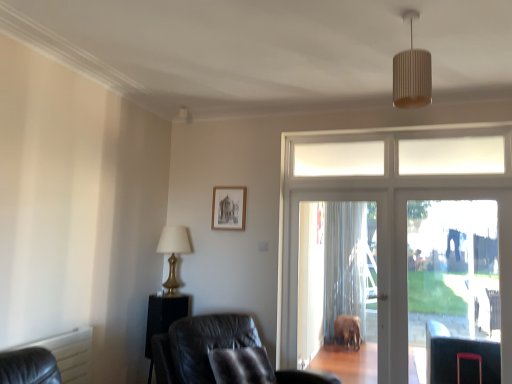
Describe the element at coordinates (229, 208) in the screenshot. I see `wooden picture frame at center` at that location.

Identify the location of transparent glass screen door at right, which is the second screen door in left-to-right order. (457, 282).

What do you see at coordinates (377, 257) in the screenshot? I see `translucent plastic screen door at center, acting as the 2th screen door starting from the right` at bounding box center [377, 257].

At what (x,y) coordinates should I click in order to perform the action: click on translucent plastic screen door at center, acting as the 2th screen door starting from the right. Please return your answer as a coordinate pair (x, y). This screenshot has height=384, width=512. Looking at the image, I should click on (377, 257).

What do you see at coordinates (163, 318) in the screenshot? The image size is (512, 384). I see `black leather side table at lower left` at bounding box center [163, 318].

The width and height of the screenshot is (512, 384). Describe the element at coordinates (199, 346) in the screenshot. I see `leather chair at lower center` at that location.

Where is `wooden picture frame at center`? wooden picture frame at center is located at coordinates (229, 208).

From a real-world perspective, is wooden picture frame at center under leather chair at lower center?

Incorrect, from a real-world perspective, wooden picture frame at center is higher than leather chair at lower center.

Does point (222, 225) come farther from viewer compared to point (180, 347)?

Yes, point (222, 225) is farther from viewer.

From the image's perspective, between wooden picture frame at center and leather chair at lower center, which one is located above?

From the image's view, wooden picture frame at center is above.

Between wooden picture frame at center and leather chair at lower center, which one has smaller size?

wooden picture frame at center.

Is transparent glass screen door at right, which is the second screen door in left-to-right order, to the left or to the right of wooden picture frame at center in the image?

Clearly, transparent glass screen door at right, which is the second screen door in left-to-right order, is on the right of wooden picture frame at center in the image.

Can wooden picture frame at center be found inside transparent glass screen door at right, which is the second screen door in left-to-right order?

No.

Does transparent glass screen door at right, the 1th screen door from the right, come behind wooden picture frame at center?

No, the depth of transparent glass screen door at right, the 1th screen door from the right, is less than that of wooden picture frame at center.

Is transparent glass screen door at right, which is the second screen door in left-to-right order, looking in the opposite direction of wooden picture frame at center?

transparent glass screen door at right, which is the second screen door in left-to-right order, does not have its back to wooden picture frame at center.

Does gold metallic table lamp at left touch transparent glass screen door at right, which is the second screen door in left-to-right order?

They are not placed beside each other.

Which of these two, gold metallic table lamp at left or transparent glass screen door at right, which is the second screen door in left-to-right order, is thinner?

transparent glass screen door at right, which is the second screen door in left-to-right order.

Can you tell me how much gold metallic table lamp at left and transparent glass screen door at right, which is the second screen door in left-to-right order, differ in facing direction?

2.77 degrees separate the facing orientations of gold metallic table lamp at left and transparent glass screen door at right, which is the second screen door in left-to-right order.

From the image's perspective, is gold metallic table lamp at left located above transparent glass screen door at right, which is the second screen door in left-to-right order?

Indeed, from the image's perspective, gold metallic table lamp at left is shown above transparent glass screen door at right, which is the second screen door in left-to-right order.

Is point (162, 338) closer or farther from the camera than point (178, 233)?

Clearly, point (162, 338) is closer to the camera than point (178, 233).

Is leather chair at lower center far away from gold metallic table lamp at left?

No, there isn't a large distance between leather chair at lower center and gold metallic table lamp at left.

Is leather chair at lower center facing towards gold metallic table lamp at left?

No, leather chair at lower center does not turn towards gold metallic table lamp at left.

Based on their positions, is leather chair at lower center located to the left or right of translucent plastic screen door at center, acting as the 2th screen door starting from the right?

leather chair at lower center is to the left of translucent plastic screen door at center, acting as the 2th screen door starting from the right.

Between point (158, 346) and point (387, 382), which one is positioned in front?

The point (158, 346) is closer to the camera.

Can we say leather chair at lower center lies outside translucent plastic screen door at center, acting as the 2th screen door starting from the right?

Absolutely, leather chair at lower center is external to translucent plastic screen door at center, acting as the 2th screen door starting from the right.

Is the depth of wooden picture frame at center greater than that of black leather side table at lower left?

That is True.

Which is nearer, [218,203] or [190,305]?

Clearly, point [218,203] is more distant from the camera than point [190,305].

Which is more to the left, wooden picture frame at center or black leather side table at lower left?

From the viewer's perspective, black leather side table at lower left appears more on the left side.

Considering the sizes of wooden picture frame at center and black leather side table at lower left in the image, is wooden picture frame at center taller or shorter than black leather side table at lower left?

In the image, wooden picture frame at center appears to be shorter than black leather side table at lower left.

Can you see wooden picture frame at center touching white ribbed shade at upper center?

No, wooden picture frame at center is not with white ribbed shade at upper center.

Which object is closer to the camera taking this photo, wooden picture frame at center or white ribbed shade at upper center?

white ribbed shade at upper center.

The image size is (512, 384). I want to click on picture frame below the white ribbed shade at upper center (from the image's perspective), so click(x=229, y=208).

Where is `chair lying below the wooden picture frame at center (from the image's perspective)`? This screenshot has height=384, width=512. chair lying below the wooden picture frame at center (from the image's perspective) is located at coordinates (199, 346).

This screenshot has width=512, height=384. I want to click on picture frame on the left side of transparent glass screen door at right, the 1th screen door from the right, so click(229, 208).

When comparing their distances from leather chair at lower center, does black leather side table at lower left or white ribbed shade at upper center seem further?

white ribbed shade at upper center is further to leather chair at lower center.

From the image, which object appears to be nearer to transparent glass screen door at right, the 1th screen door from the right, gold metallic table lamp at left or black leather side table at lower left?

gold metallic table lamp at left is closer to transparent glass screen door at right, the 1th screen door from the right.

Based on their spatial positions, is white glass door at center or white ribbed shade at upper center further from gold metallic table lamp at left?

white ribbed shade at upper center is further to gold metallic table lamp at left.

When comparing their distances from gold metallic table lamp at left, does transparent glass screen door at right, which is the second screen door in left-to-right order, or black leather side table at lower left seem further?

transparent glass screen door at right, which is the second screen door in left-to-right order, lies further to gold metallic table lamp at left than the other object.

When comparing their distances from white ribbed shade at upper center, does wooden picture frame at center or leather chair at lower center seem closer?

Based on the image, wooden picture frame at center appears to be nearer to white ribbed shade at upper center.

Looking at this image, considering their positions, is wooden picture frame at center positioned further to transparent glass screen door at right, which is the second screen door in left-to-right order, than leather chair at lower center?

leather chair at lower center is further to transparent glass screen door at right, which is the second screen door in left-to-right order.

Looking at this image, when comparing their distances from wooden picture frame at center, does transparent glass screen door at right, the 1th screen door from the right, or white ribbed shade at upper center seem closer?

The object closer to wooden picture frame at center is white ribbed shade at upper center.

Estimate the real-world distances between objects in this image. Which object is further from transparent glass screen door at right, the 1th screen door from the right, leather chair at lower center or gold metallic table lamp at left?

Among the two, gold metallic table lamp at left is located further to transparent glass screen door at right, the 1th screen door from the right.

The height and width of the screenshot is (384, 512). In order to click on picture frame between black leather side table at lower left and translucent plastic screen door at center, acting as the first screen door starting from the left, from left to right in this screenshot , I will do `click(229, 208)`.

This screenshot has height=384, width=512. I want to click on table lamp between white ribbed shade at upper center and wooden picture frame at center in the front-back direction, so click(x=173, y=252).

Find the location of `chair between wooden picture frame at center and transparent glass screen door at right, the 1th screen door from the right`. chair between wooden picture frame at center and transparent glass screen door at right, the 1th screen door from the right is located at coordinates (199, 346).

Where is `picture frame between gold metallic table lamp at left and transparent glass screen door at right, which is the second screen door in left-to-right order, in the horizontal direction`? The height and width of the screenshot is (384, 512). picture frame between gold metallic table lamp at left and transparent glass screen door at right, which is the second screen door in left-to-right order, in the horizontal direction is located at coordinates (229, 208).